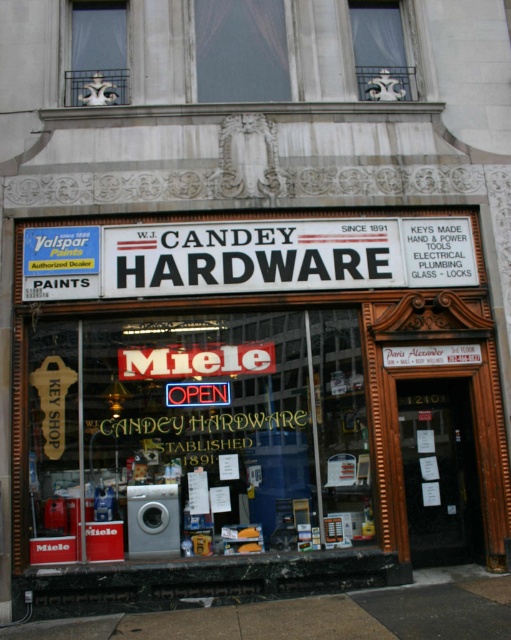
You are a delivery person trying to drop off a package for W.J. Candey Hardware. The package must be placed at the exact location of the transparent glass window at center. According to the coordinates provided, where should you position the package?

The transparent glass window at center is located at point (x=197, y=435), so you should position the package at those coordinates.